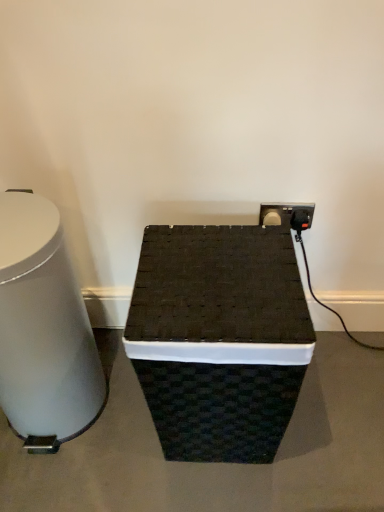
Identify the location of black woven basket at center. The height and width of the screenshot is (512, 384). (219, 339).

This screenshot has height=512, width=384. Describe the element at coordinates (219, 339) in the screenshot. I see `black woven basket at center` at that location.

This screenshot has width=384, height=512. I want to click on white glossy trash can at left, so tap(43, 326).

What do you see at coordinates (43, 326) in the screenshot? This screenshot has height=512, width=384. I see `white glossy trash can at left` at bounding box center [43, 326].

The image size is (384, 512). In order to click on black woven basket at center in this screenshot , I will do `click(219, 339)`.

Visually, is white glossy trash can at left positioned to the left or to the right of black woven basket at center?

From the image, it's evident that white glossy trash can at left is to the left of black woven basket at center.

Is white glossy trash can at left further to the viewer compared to black woven basket at center?

No, the depth of white glossy trash can at left is less than that of black woven basket at center.

Is point (35, 408) positioned before point (215, 384)?

That is False.

Based on the photo, from the image's perspective, would you say white glossy trash can at left is shown under black woven basket at center?

Incorrect, from the image's perspective, white glossy trash can at left is higher than black woven basket at center.

From a real-world perspective, is white glossy trash can at left physically located above or below black woven basket at center?

white glossy trash can at left is above black woven basket at center.

Considering the sizes of white glossy trash can at left and black woven basket at center in the image, is white glossy trash can at left wider or thinner than black woven basket at center?

Considering their sizes, white glossy trash can at left looks slimmer than black woven basket at center.

Considering the sizes of objects white glossy trash can at left and black woven basket at center in the image provided, who is shorter, white glossy trash can at left or black woven basket at center?

black woven basket at center is shorter.

Between white glossy trash can at left and black woven basket at center, which one has smaller size?

With smaller size is white glossy trash can at left.

Is black woven basket at center inside white glossy trash can at left?

No, black woven basket at center is not inside white glossy trash can at left.

Are white glossy trash can at left and black woven basket at center far apart?

Actually, white glossy trash can at left and black woven basket at center are a little close together.

Is black woven basket at center at the back of white glossy trash can at left?

No, black woven basket at center is not at the back of white glossy trash can at left.

Identify the location of table in front of the black woven basket at center. The height and width of the screenshot is (512, 384). (43, 326).

Which is more to the right, black woven basket at center or white glossy trash can at left?

Positioned to the right is black woven basket at center.

Does black woven basket at center lie in front of white glossy trash can at left?

No, black woven basket at center is behind white glossy trash can at left.

Is point (184, 400) in front of point (57, 237)?

No, (184, 400) is behind (57, 237).

From the picture: From the image's perspective, which is above, black woven basket at center or white glossy trash can at left?

From the image's view, white glossy trash can at left is above.

From a real-world perspective, relative to white glossy trash can at left, is black woven basket at center vertically above or below?

In terms of real-world spatial position, black woven basket at center is below white glossy trash can at left.

Is black woven basket at center wider or thinner than white glossy trash can at left?

Clearly, black woven basket at center has more width compared to white glossy trash can at left.

Does black woven basket at center have a lesser height compared to white glossy trash can at left?

Yes, black woven basket at center is shorter than white glossy trash can at left.

Is black woven basket at center smaller than white glossy trash can at left?

No.

Is white glossy trash can at left surrounded by black woven basket at center?

No, black woven basket at center does not contain white glossy trash can at left.

Is the surface of black woven basket at center in direct contact with white glossy trash can at left?

There is a gap between black woven basket at center and white glossy trash can at left.

Is black woven basket at center turned away from white glossy trash can at left?

No, white glossy trash can at left is not at the back of black woven basket at center.

Can you tell me how much black woven basket at center and white glossy trash can at left differ in facing direction?

0.000305 degrees.

What are the coordinates of `furniture beneath the white glossy trash can at left (from a real-world perspective)` in the screenshot? It's located at (219, 339).

The height and width of the screenshot is (512, 384). What are the coordinates of `table above the black woven basket at center (from the image's perspective)` in the screenshot? It's located at (43, 326).

The height and width of the screenshot is (512, 384). I want to click on table located on the left of black woven basket at center, so click(43, 326).